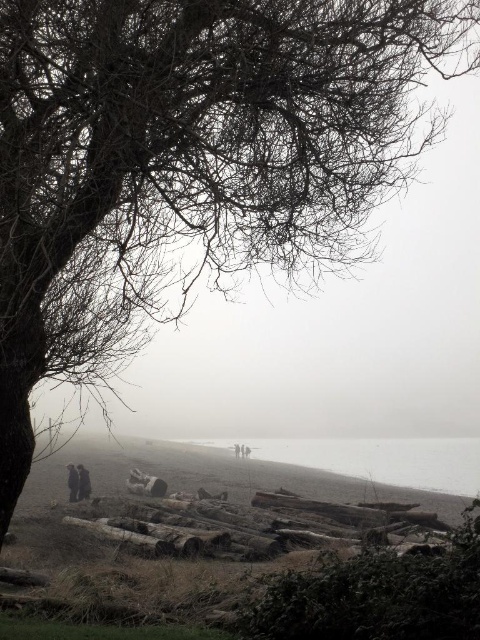
Question: Which point is farther to the camera?

Choices:
 (A) (250, 624)
 (B) (86, 468)

Answer: (B)

Question: Observing the image, what is the correct spatial positioning of wooden logs at lower center in reference to dark gray fabric jacket at lower left?

Choices:
 (A) right
 (B) left

Answer: (A)

Question: Which point is closer to the camera?

Choices:
 (A) (361, 540)
 (B) (262, 612)
 (C) (233, 444)

Answer: (B)

Question: Among these points, which one is nearest to the camera?

Choices:
 (A) (78, 490)
 (B) (233, 449)

Answer: (A)

Question: Is gray foggy water at lower center smaller than dark gray fabric jacket at lower left?

Choices:
 (A) yes
 (B) no

Answer: (B)

Question: Is wooden logs at lower center bigger than dark gray fabric jacket at center?

Choices:
 (A) yes
 (B) no

Answer: (A)